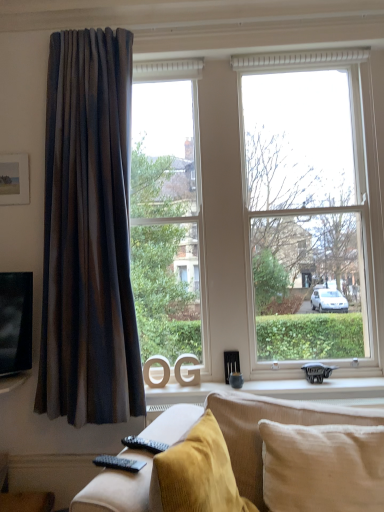
Locate an element on the screen. The image size is (384, 512). transparent glass window at center is located at coordinates (271, 205).

Describe the element at coordinates (271, 205) in the screenshot. The height and width of the screenshot is (512, 384). I see `transparent glass window at center` at that location.

This screenshot has width=384, height=512. What do you see at coordinates (322, 467) in the screenshot?
I see `beige cotton pillow at lower right` at bounding box center [322, 467].

Find the location of a particular element. The width and height of the screenshot is (384, 512). transparent glass window at center is located at coordinates (271, 205).

Is matte wooden picture frame at upper left smaller than transparent glass window at center?

Indeed, matte wooden picture frame at upper left has a smaller size compared to transparent glass window at center.

Is matte wooden picture frame at upper left not near transparent glass window at center?

Yes, matte wooden picture frame at upper left is far from transparent glass window at center.

Which of these two, matte wooden picture frame at upper left or transparent glass window at center, stands shorter?

matte wooden picture frame at upper left is shorter.

Which is in front, beige cotton pillow at lower right or transparent glass window at center?

Positioned in front is beige cotton pillow at lower right.

In the scene shown: Would you say beige cotton pillow at lower right is inside or outside transparent glass window at center?

beige cotton pillow at lower right cannot be found inside transparent glass window at center.

From the image's perspective, between beige cotton pillow at lower right and transparent glass window at center, which one is located above?

transparent glass window at center.

Is beige cotton pillow at lower right oriented away from transparent glass window at center?

No, transparent glass window at center is not at the back of beige cotton pillow at lower right.

Locate an element on the screen. The height and width of the screenshot is (512, 384). curtain on the left side of beige cotton pillow at lower right is located at coordinates (88, 234).

Can you confirm if matte brown curtain at left is shorter than beige cotton pillow at lower right?

No.

Is matte brown curtain at left thinner than beige cotton pillow at lower right?

Yes, matte brown curtain at left is thinner than beige cotton pillow at lower right.

Between matte brown curtain at left and beige cotton pillow at lower right, which one appears on the right side from the viewer's perspective?

Positioned to the right is beige cotton pillow at lower right.

Is velvet mustard studio couch at lower center aimed at matte wooden picture frame at upper left?

No.

Is velvet mustard studio couch at lower center wider than matte wooden picture frame at upper left?

Correct, the width of velvet mustard studio couch at lower center exceeds that of matte wooden picture frame at upper left.

Is velvet mustard studio couch at lower center positioned far away from matte wooden picture frame at upper left?

Yes, velvet mustard studio couch at lower center and matte wooden picture frame at upper left are located far from each other.

In the scene shown: From a real-world perspective, is velvet mustard studio couch at lower center physically located above or below matte wooden picture frame at upper left?

In terms of real-world spatial position, velvet mustard studio couch at lower center is below matte wooden picture frame at upper left.

In terms of size, does white matte window sill at center appear bigger or smaller than black plastic remote at lower left?

Considering their sizes, white matte window sill at center takes up more space than black plastic remote at lower left.

In terms of height, does white matte window sill at center look taller or shorter compared to black plastic remote at lower left?

Considering their sizes, white matte window sill at center has less height than black plastic remote at lower left.

What's the angular difference between velvet mustard studio couch at lower center and transparent glass window at center's facing directions?

The angular difference between velvet mustard studio couch at lower center and transparent glass window at center is 15.2 degrees.

Is velvet mustard studio couch at lower center positioned far away from transparent glass window at center?

Indeed, velvet mustard studio couch at lower center is not near transparent glass window at center.

Would you say velvet mustard studio couch at lower center is to the left or to the right of transparent glass window at center in the picture?

velvet mustard studio couch at lower center is positioned on transparent glass window at center's left side.

Is transparent glass window at center at the back of velvet mustard studio couch at lower center?

No.

Is transparent glass window at center to the left of velvet mustard studio couch at lower center from the viewer's perspective?

No.

Can you confirm if transparent glass window at center is taller than velvet mustard studio couch at lower center?

Correct, transparent glass window at center is much taller as velvet mustard studio couch at lower center.

Which of these two, transparent glass window at center or velvet mustard studio couch at lower center, is wider?

velvet mustard studio couch at lower center.

Between transparent glass window at center and velvet mustard studio couch at lower center, which one is positioned behind?

transparent glass window at center.

This screenshot has width=384, height=512. I want to click on window in front of the matte wooden picture frame at upper left, so click(271, 205).

Where is `pillow below the transparent glass window at center (from the image's perspective)`? The image size is (384, 512). pillow below the transparent glass window at center (from the image's perspective) is located at coordinates (322, 467).

Based on their spatial positions, is transparent glass window at center or white matte window sill at center further from velvet mustard studio couch at lower center?

transparent glass window at center lies further to velvet mustard studio couch at lower center than the other object.

Estimate the real-world distances between objects in this image. Which object is closer to black plastic remote at lower left, transparent glass window at center or velvet mustard studio couch at lower center?

velvet mustard studio couch at lower center.

When comparing their distances from velvet mustard studio couch at lower center, does white matte window sill at center or transparent glass window at center seem further?

The object further to velvet mustard studio couch at lower center is transparent glass window at center.

Looking at the image, which one is located further to transparent glass window at center, matte brown curtain at left or velvet mustard studio couch at lower center?

velvet mustard studio couch at lower center.

Based on their spatial positions, is black plastic remote at lower left or white matte window sill at center closer to beige cotton pillow at lower right?

white matte window sill at center lies closer to beige cotton pillow at lower right than the other object.

Based on their spatial positions, is beige cotton pillow at lower right or transparent glass window at center closer to black plastic remote at lower left?

Based on the image, beige cotton pillow at lower right appears to be nearer to black plastic remote at lower left.

From the picture: Estimate the real-world distances between objects in this image. Which object is further from black plastic remote at lower left, velvet mustard studio couch at lower center or matte brown curtain at left?

The object further to black plastic remote at lower left is matte brown curtain at left.

Looking at the image, which one is located closer to black plastic remote at lower left, white matte window sill at center or matte brown curtain at left?

white matte window sill at center is closer to black plastic remote at lower left.

You are a GUI agent. You are given a task and a screenshot of the screen. Output one action in this format:
    pyautogui.click(x=<x>, y=<y>)
    Task: Click on the remote between matte wooden picture frame at upper left and transparent glass window at center in the horizontal direction
    The width and height of the screenshot is (384, 512).
    Given the screenshot: What is the action you would take?
    pyautogui.click(x=118, y=463)

The height and width of the screenshot is (512, 384). I want to click on window sill situated between matte wooden picture frame at upper left and beige cotton pillow at lower right from left to right, so click(x=323, y=390).

Locate an element on the screen. The height and width of the screenshot is (512, 384). window between velvet mustard studio couch at lower center and matte wooden picture frame at upper left along the z-axis is located at coordinates (271, 205).

You are a GUI agent. You are given a task and a screenshot of the screen. Output one action in this format:
    pyautogui.click(x=<x>, y=<y>)
    Task: Click on the remote between matte wooden picture frame at upper left and white matte window sill at center
    The height and width of the screenshot is (512, 384).
    Given the screenshot: What is the action you would take?
    pyautogui.click(x=118, y=463)